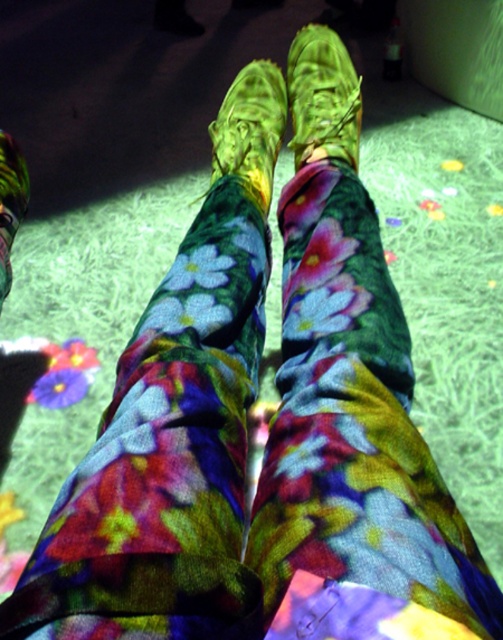
Question: Among these points, which one is farthest from the camera?

Choices:
 (A) (12, 205)
 (B) (244, 88)
 (C) (332, 42)

Answer: (C)

Question: Which object is the closest to the green suede shoe at center?

Choices:
 (A) green suede boot at center
 (B) leather-like green shoe at center

Answer: (A)

Question: Is leather-like green shoe at center smaller than green suede boot at center?

Choices:
 (A) yes
 (B) no

Answer: (B)

Question: Does leather-like green shoe at center appear on the left side of green suede shoe at center?

Choices:
 (A) no
 (B) yes

Answer: (A)

Question: Which point is farther to the camera?

Choices:
 (A) green suede boot at center
 (B) leather-like green shoe at center
 (C) green suede shoe at center

Answer: (C)

Question: Observing the image, what is the correct spatial positioning of leather-like green shoe at center in reference to green suede shoe at center?

Choices:
 (A) right
 (B) left

Answer: (A)